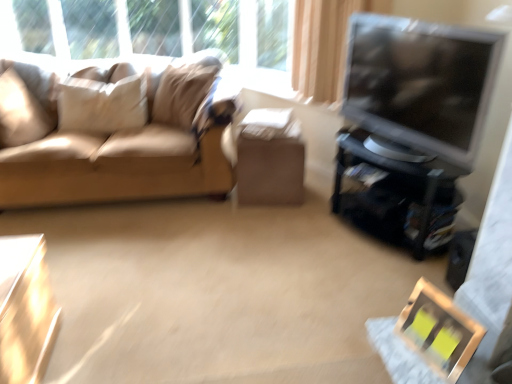
Question: From a real-world perspective, is matte black tv at right physically above matte cardboard box at center, placed as the first table when sorted from top to bottom?

Choices:
 (A) no
 (B) yes

Answer: (B)

Question: From the image's perspective, is matte black tv at right under matte cardboard box at center, which is counted as the second table, starting from the left?

Choices:
 (A) no
 (B) yes

Answer: (A)

Question: Can you confirm if matte black tv at right is positioned to the left of matte cardboard box at center, placed as the first table when sorted from top to bottom?

Choices:
 (A) yes
 (B) no

Answer: (B)

Question: Is matte cardboard box at center, the 1th table viewed from the back, at the back of matte black tv at right?

Choices:
 (A) yes
 (B) no

Answer: (B)

Question: From a real-world perspective, is matte black tv at right located beneath matte cardboard box at center, the second table in the front-to-back sequence?

Choices:
 (A) yes
 (B) no

Answer: (B)

Question: Considering the relative positions of matte black tv at right and matte cardboard box at center, which is the second table in bottom-to-top order, in the image provided, is matte black tv at right behind matte cardboard box at center, which is the second table in bottom-to-top order,?

Choices:
 (A) no
 (B) yes

Answer: (A)

Question: From a real-world perspective, is matte cardboard box at center, which is counted as the second table, starting from the left, located higher than shiny metallic table at lower left, the 2th table viewed from the right?

Choices:
 (A) no
 (B) yes

Answer: (B)

Question: Is matte cardboard box at center, the 1th table viewed from the back, next to shiny metallic table at lower left, the 2th table viewed from the top, and touching it?

Choices:
 (A) yes
 (B) no

Answer: (B)

Question: Does matte cardboard box at center, which is the first table from right to left, have a lesser height compared to shiny metallic table at lower left, the 2th table viewed from the right?

Choices:
 (A) no
 (B) yes

Answer: (A)

Question: From the image's perspective, is matte cardboard box at center, which is counted as the second table, starting from the left, located beneath shiny metallic table at lower left, the second table viewed from the back?

Choices:
 (A) yes
 (B) no

Answer: (B)

Question: Is matte cardboard box at center, the second table in the front-to-back sequence, surrounding shiny metallic table at lower left, the 2th table viewed from the right?

Choices:
 (A) yes
 (B) no

Answer: (B)

Question: Considering the relative positions of matte cardboard box at center, the 1th table viewed from the back, and shiny metallic table at lower left, placed as the 1th table when sorted from front to back, in the image provided, is matte cardboard box at center, the 1th table viewed from the back, to the left of shiny metallic table at lower left, placed as the 1th table when sorted from front to back, from the viewer's perspective?

Choices:
 (A) no
 (B) yes

Answer: (A)

Question: Is wooden picture frame at lower right looking in the opposite direction of matte black tv stand at right?

Choices:
 (A) yes
 (B) no

Answer: (B)